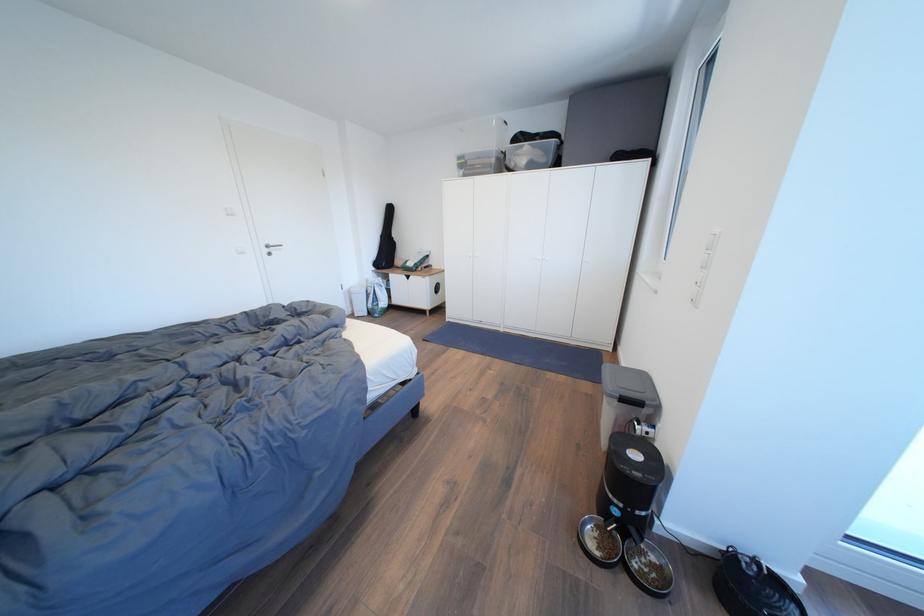
Find where to lift the pet feeder lid. Please return your answer as a coordinate pair (x, y).

(752, 586)